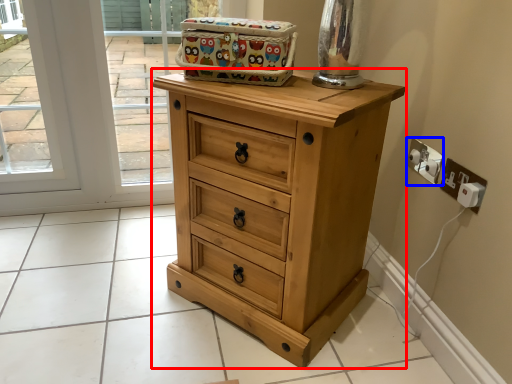
Question: Among these objects, which one is farthest to the camera, chest of drawers (highlighted by a red box) or electric outlet (highlighted by a blue box)?

Choices:
 (A) chest of drawers
 (B) electric outlet

Answer: (B)